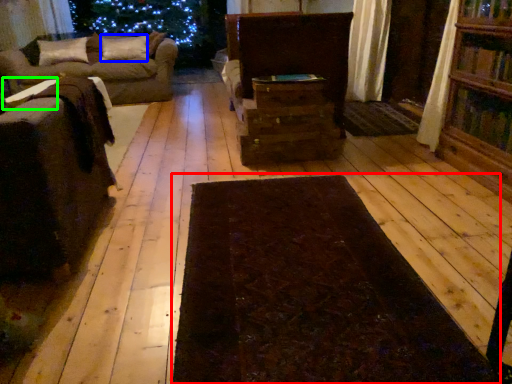
Question: Estimate the real-world distances between objects in this image. Which object is farther from mat (highlighted by a red box), pillow (highlighted by a blue box) or table (highlighted by a green box)?

Choices:
 (A) pillow
 (B) table

Answer: (A)